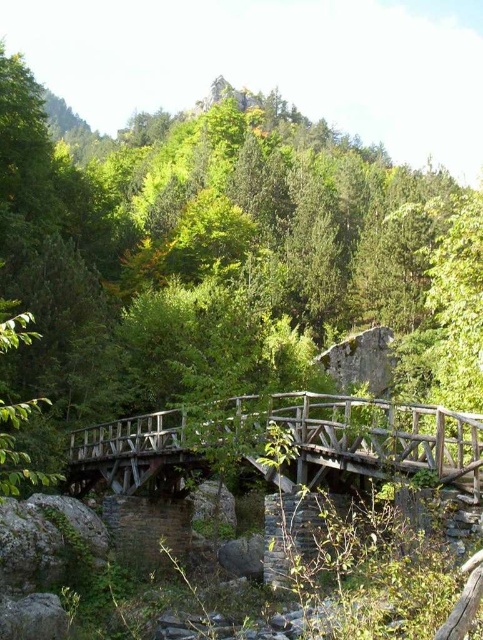
Is point (389, 164) farther from viewer compared to point (413, 408)?

Yes.

Can you confirm if green matte tree at center is positioned to the left of wooden bridge at center?

Correct, you'll find green matte tree at center to the left of wooden bridge at center.

What are the coordinates of `green matte tree at center` in the screenshot? It's located at click(196, 252).